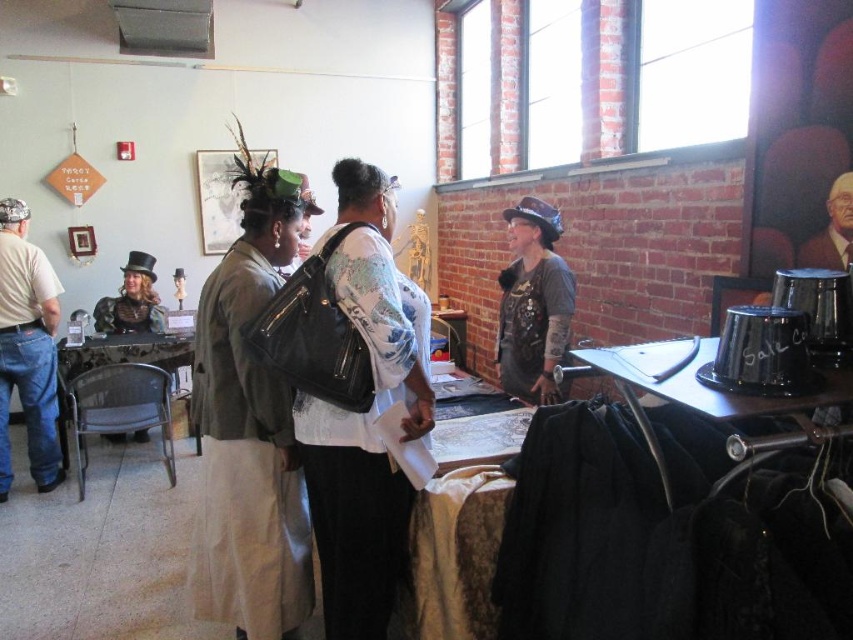
You are organizing a small event in this room and need to place a 6.5 feet long table between the matte black purse at center and the denim jeans at left. Is there enough space to fit the table between them?

The distance between the matte black purse at center and the denim jeans at left is 6.29 feet, which is slightly shorter than the 6.5 feet table. Therefore, there is not enough space to fit the table between them.